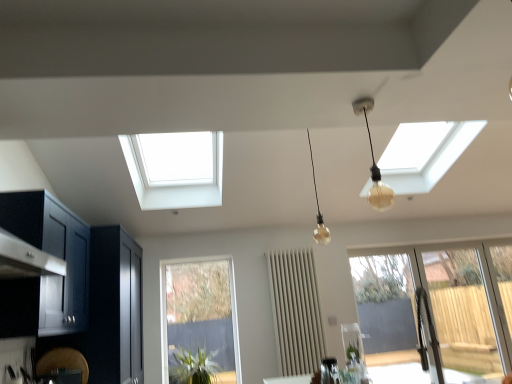
Question: Would you say clear glass window at lower center, the 1th window positioned from the left, is to the left or to the right of clear glass door at lower right, which ranks as the 2th window in left-to-right order, in the picture?

Choices:
 (A) right
 (B) left

Answer: (B)

Question: Considering the positions of clear glass window at lower center, the 1th window positioned from the left, and clear glass door at lower right, marked as the first window in a right-to-left arrangement, in the image, is clear glass window at lower center, the 1th window positioned from the left, bigger or smaller than clear glass door at lower right, marked as the first window in a right-to-left arrangement,?

Choices:
 (A) big
 (B) small

Answer: (B)

Question: Based on their relative distances, which object is nearer to the matte glass bulb at upper center, which appears as the 2th lamp when viewed from the back?

Choices:
 (A) clear glass door at lower right, marked as the first window in a right-to-left arrangement
 (B) green leafy plant at lower center
 (C) matte black cabinets at left
 (D) beige fabric radiator at center
 (E) matte glass bulb at center, which appears as the second lamp when viewed from the front

Answer: (E)

Question: Which object is positioned farthest from the clear glass door at lower right, which ranks as the 2th window in left-to-right order?

Choices:
 (A) clear glass window at lower center, the 1th window positioned from the left
 (B) matte glass bulb at center, which appears as the second lamp when viewed from the front
 (C) beige fabric radiator at center
 (D) matte glass bulb at upper center, which appears as the 2th lamp when viewed from the back
 (E) green leafy plant at lower center

Answer: (E)